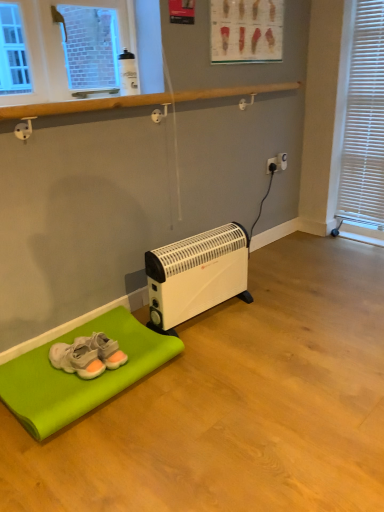
Question: From a real-world perspective, relative to green fabric mat at lower left, is gray suede sneakers at lower left vertically above or below?

Choices:
 (A) below
 (B) above

Answer: (B)

Question: Considering their positions, is gray suede sneakers at lower left located in front of or behind green fabric mat at lower left?

Choices:
 (A) behind
 (B) front

Answer: (A)

Question: Which is nearer to the white plastic electric outlet at upper right, arranged as the first electric outlet when viewed from the left?

Choices:
 (A) green fabric mat at lower left
 (B) white plastic heater at lower center
 (C) white plastic blinds at right
 (D) gray suede sneakers at lower left
 (E) white plastic electric outlet at center-right, placed as the second electric outlet when sorted from left to right

Answer: (E)

Question: Estimate the real-world distances between objects in this image. Which object is closer to the gray suede sneakers at lower left?

Choices:
 (A) green fabric mat at lower left
 (B) white plastic electric outlet at center-right, which is the 1th electric outlet from right to left
 (C) white plastic blinds at right
 (D) white plastic electric outlet at upper right, marked as the second electric outlet in a right-to-left arrangement
 (E) white plastic heater at lower center

Answer: (A)